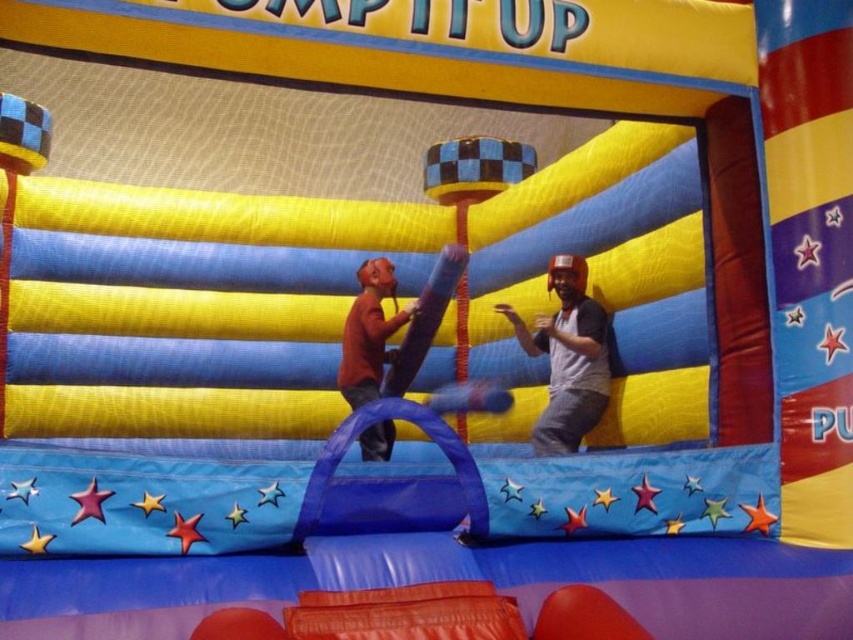
You are a safety inspector checking the bouncy castle. You notice the gray matte helmet at upper right and the matte brown shirt at center. Which object is closer to the inspector from the inspector perspective?

The gray matte helmet at upper right is closer to the inspector because it is in front of the matte brown shirt at center.

You are standing outside the bouncy castle and see the point at coordinates (567,358). Which object is located at that point?

The point at coordinates (567,358) corresponds to the gray matte helmet at upper right.

You are a photographer trying to capture a photo of the gray matte helmet at upper right and the matte brown shirt at center. Which object should you focus on first if you want to include both in your shot without moving the camera?

You should focus on the matte brown shirt at center first because the gray matte helmet at upper right is to the right of it, so keeping the shirt centered will allow the helmet to be included in the frame.